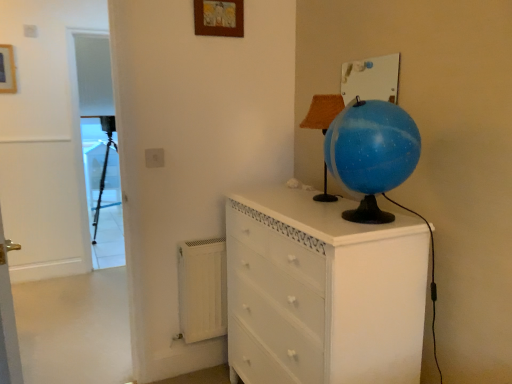
Find the location of `empty space that is ontop of white painted wood chest of drawers at center (from a real-world perspective)`. empty space that is ontop of white painted wood chest of drawers at center (from a real-world perspective) is located at coordinates (324, 201).